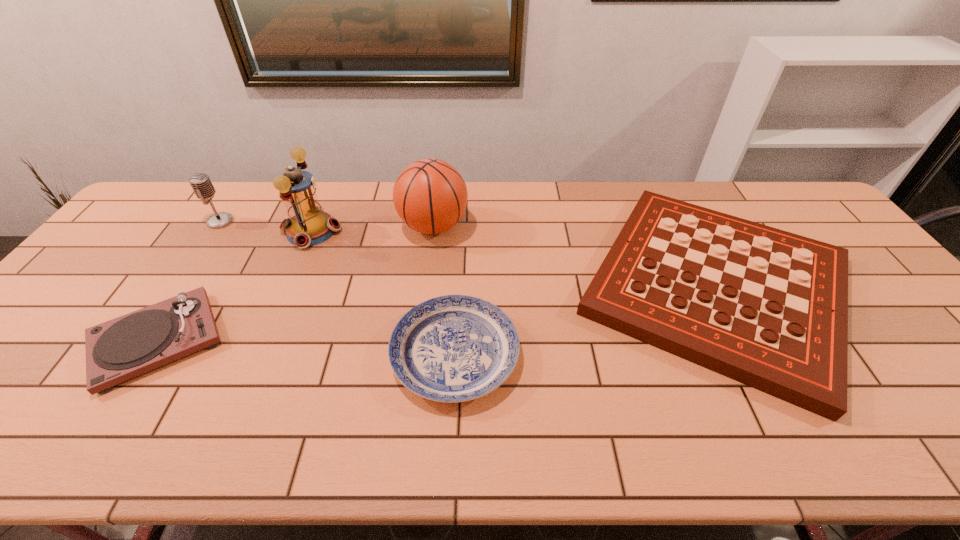
Locate an element on the screen. This screenshot has width=960, height=540. lantern is located at coordinates (308, 225).

You are a GUI agent. You are given a task and a screenshot of the screen. Output one action in this format:
    pyautogui.click(x=<x>, y=<y>)
    Task: Click on the basketball
    
    Given the screenshot: What is the action you would take?
    pyautogui.click(x=430, y=196)

The width and height of the screenshot is (960, 540). What are the coordinates of `microphone` in the screenshot? It's located at (201, 184).

At what (x,y) coordinates should I click in order to perform the action: click on phonograph_record. Please return your answer as a coordinate pair (x, y). This screenshot has width=960, height=540. Looking at the image, I should click on coord(117,350).

Locate an element on the screen. Image resolution: width=960 pixels, height=540 pixels. plate is located at coordinates click(454, 348).

Where is `free location located on the front-facing side of the lantern`? free location located on the front-facing side of the lantern is located at coordinates (419, 231).

You are a GUI agent. You are given a task and a screenshot of the screen. Output one action in this format:
    pyautogui.click(x=<x>, y=<y>)
    Task: Click on the free spot located 0.140m on the left of the basketball
    Image resolution: width=960 pixels, height=540 pixels.
    Given the screenshot: What is the action you would take?
    pyautogui.click(x=354, y=226)

You are a GUI agent. You are given a task and a screenshot of the screen. Output one action in this format:
    pyautogui.click(x=<x>, y=<y>)
    Task: Click on the free location located 0.060m on the back of the microphone
    
    Given the screenshot: What is the action you would take?
    pyautogui.click(x=232, y=203)

Where is `vacant space located 0.400m on the back of the phonograph_record`? The width and height of the screenshot is (960, 540). vacant space located 0.400m on the back of the phonograph_record is located at coordinates (243, 206).

I want to click on free space located 0.060m on the back of the shortest object, so click(458, 289).